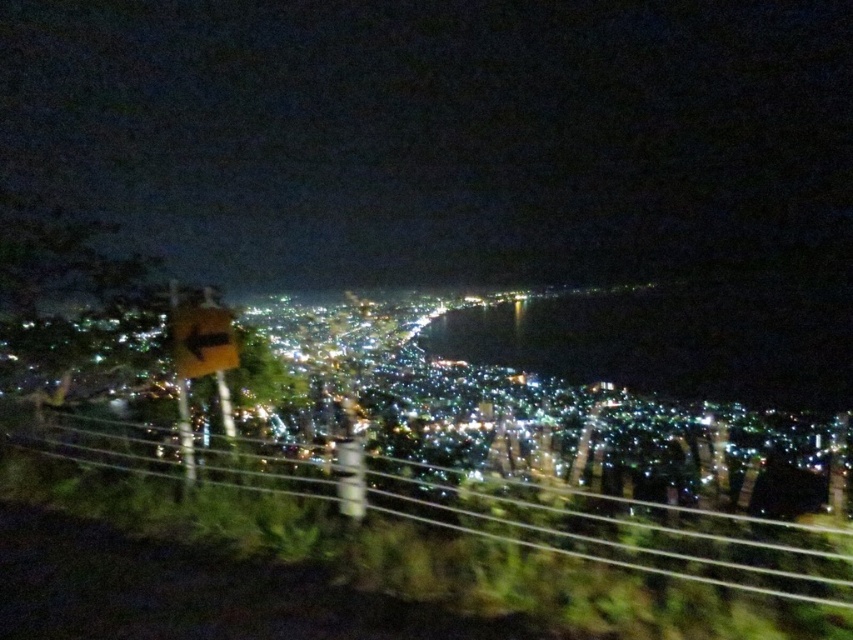
Is point (584, 500) closer to viewer compared to point (196, 308)?

Yes, point (584, 500) is in front of point (196, 308).

Is metallic wire fence at lower center below yellow matte sign at lower left?

Indeed, metallic wire fence at lower center is positioned under yellow matte sign at lower left.

Does point (746, 564) come in front of point (194, 310)?

That is True.

Locate an element on the screen. The width and height of the screenshot is (853, 640). metallic wire fence at lower center is located at coordinates (630, 534).